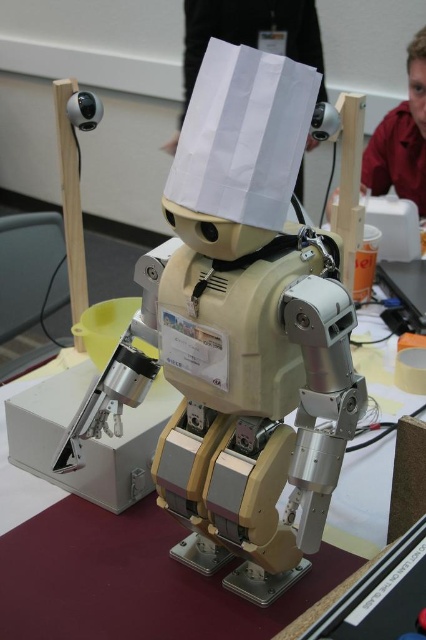
Question: Considering the relative positions of white paper at upper center and red shirt at upper right in the image provided, where is white paper at upper center located with respect to red shirt at upper right?

Choices:
 (A) right
 (B) left

Answer: (B)

Question: Which point is closer to the camera taking this photo?

Choices:
 (A) (422, 122)
 (B) (207, 26)

Answer: (A)

Question: Which point is farther to the camera?

Choices:
 (A) white paper at upper center
 (B) metallic silver table at center
 (C) red shirt at upper right

Answer: (A)

Question: Which of the following is the farthest from the observer?

Choices:
 (A) white paper at upper center
 (B) red shirt at upper right
 (C) metallic silver table at center

Answer: (A)

Question: From the image, what is the correct spatial relationship of white paper at upper center in relation to red shirt at upper right?

Choices:
 (A) above
 (B) below

Answer: (A)

Question: Is metallic silver table at center above red shirt at upper right?

Choices:
 (A) no
 (B) yes

Answer: (A)